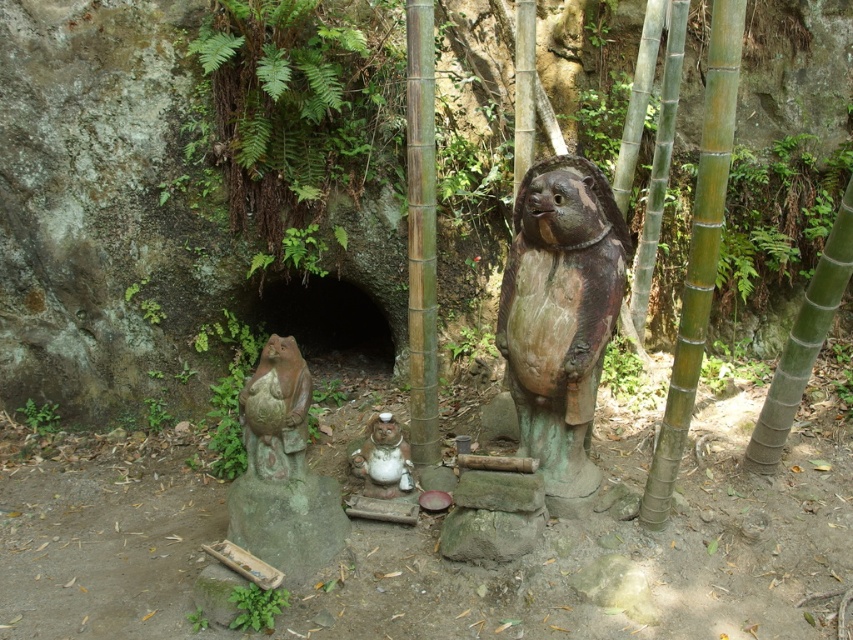
You are planning to place a small decorative item between the rustic wood bear at center and the white glossy statue at center. Considering their sizes, which bear statue should the item be closer to to maintain balance?

The rustic wood bear at center is larger than the white glossy statue at center. To maintain balance, the decorative item should be placed closer to the smaller white glossy statue at center.

You are a visitor at this serene outdoor shrine and want to take a photo of both the rustic stone statue at lower left and the white glossy statue at center. Since you want both statues to be in the frame, which statue should you focus on to ensure both are visible?

The rustic stone statue at lower left is taller than the white glossy statue at center. To ensure both are visible in the frame, focus on the taller rustic stone statue at lower left and adjust your camera angle to include the shorter white glossy statue at center.